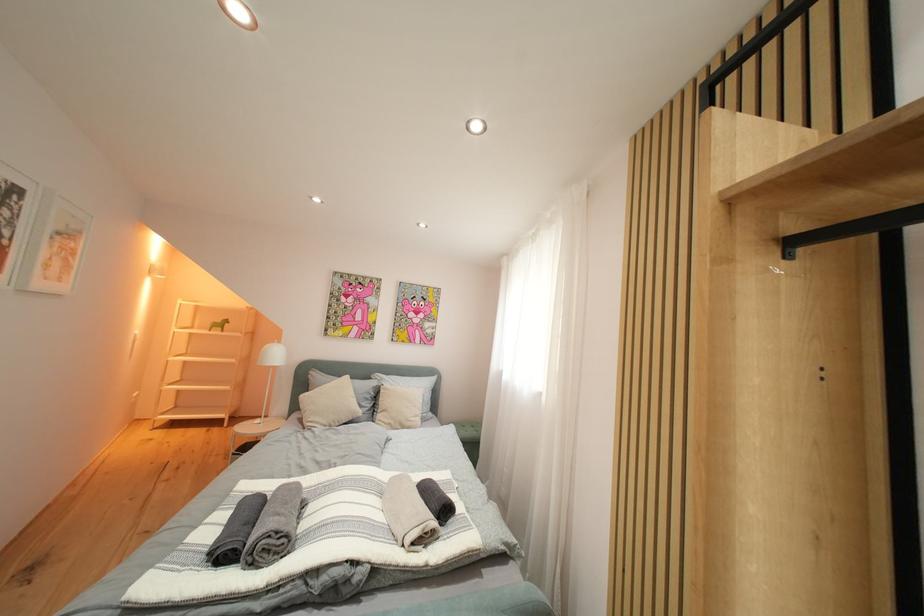
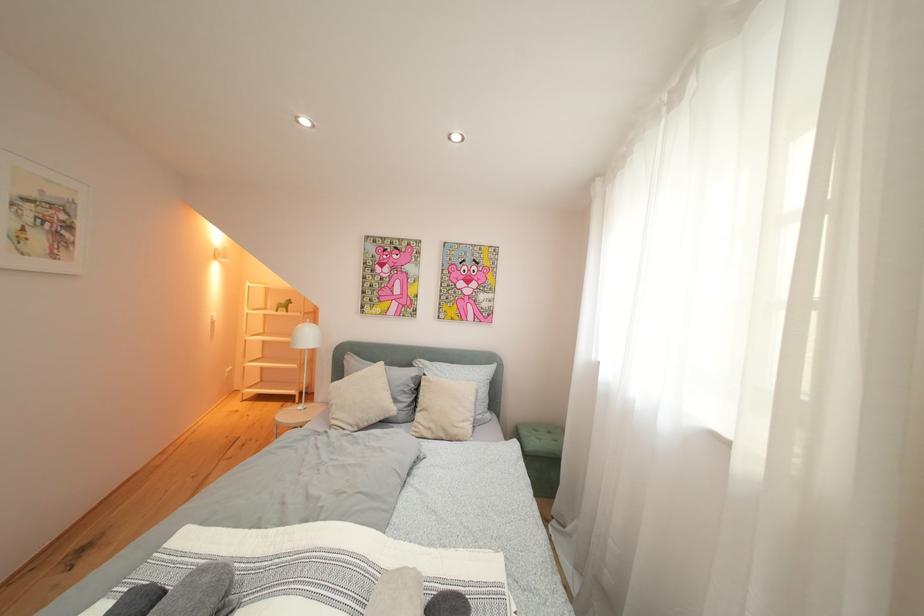
Question: The camera is either moving clockwise (left) or counter-clockwise (right) around the object. The first image is from the beginning of the video and the second image is from the end. Is the camera moving left or right when shooting the video?

Choices:
 (A) Left
 (B) Right

Answer: (B)